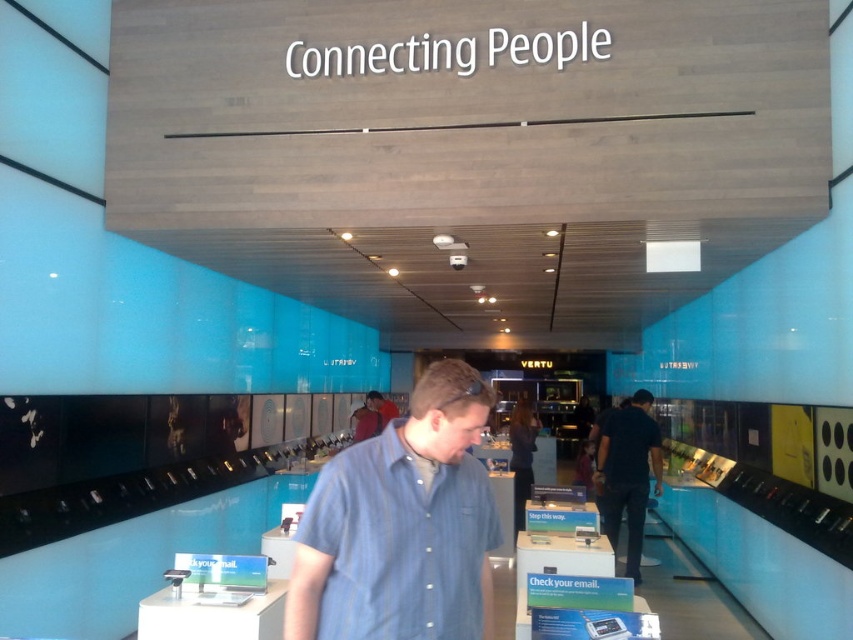
Consider the image. You are a store employee organizing shirts on a rack. You have a blue striped shirt at center and a dark blue shirt at center. Which shirt should you place on the wider hanger to ensure it fits properly?

The blue striped shirt at center should be placed on the wider hanger because it might be wider than the dark blue shirt at center.

You are a customer in the store and want to locate the blue striped shirt at center. According to the coordinates provided, where should you look?

The blue striped shirt at center is located at coordinates point (402, 525).

You are a customer in the store and want to buy a shirt. You see a blue striped shirt at center and a dark blue shirt at center. Which shirt is smaller in size?

The blue striped shirt at center is smaller in size compared to the dark blue shirt at center.